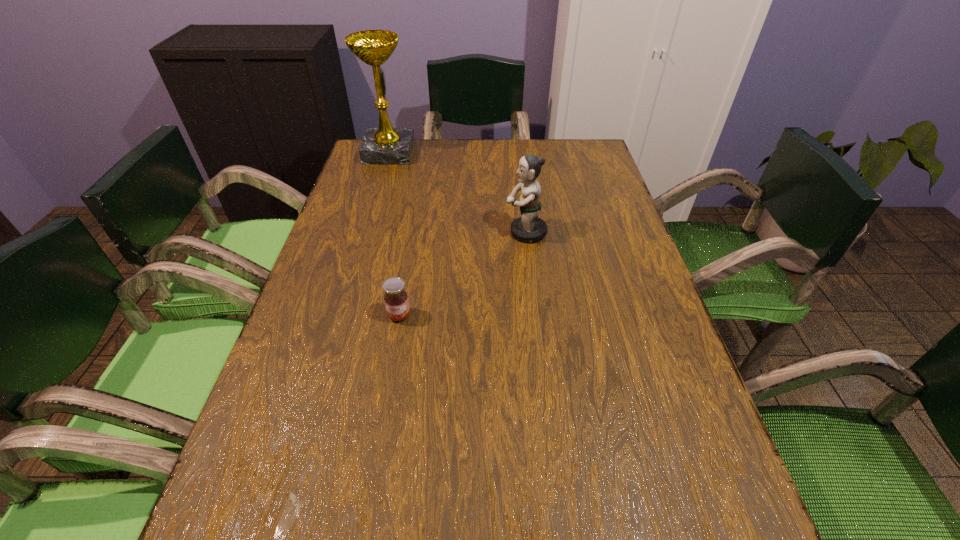
Identify the location of free point between the shortest object and the leftmost object. (395, 234).

Locate an element on the screen. The height and width of the screenshot is (540, 960). free space between the jam and the tallest object is located at coordinates (395, 234).

Identify the location of free area in between the second object from right to left and the leftmost object. (395, 234).

The image size is (960, 540). Identify the location of free spot between the award and the nearest object. (395, 234).

Locate an element on the screen. free spot between the second farthest object and the second object from left to right is located at coordinates (463, 274).

I want to click on free space between the leftmost object and the rightmost object, so click(457, 193).

At what (x,y) coordinates should I click in order to perform the action: click on vacant region between the second object from right to left and the award. Please return your answer as a coordinate pair (x, y). Looking at the image, I should click on (395, 234).

Identify the location of object that ranks as the second closest to the jam. This screenshot has width=960, height=540. (385, 145).

Identify which object is the closest to the shortest object. Please provide its 2D coordinates. Your answer should be formatted as a tuple, i.e. [(x, y)], where the tuple contains the x and y coordinates of a point satisfying the conditions above.

[(530, 228)]

What are the coordinates of `vacant space that satisfies the following two spatial constraints: 1. on the front-facing side of the second tallest object; 2. on the label side of the second object from right to left` in the screenshot? It's located at [536, 315].